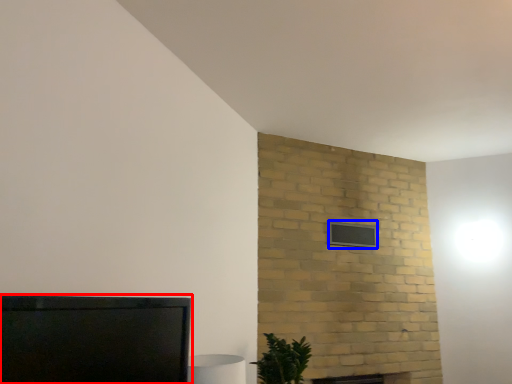
Question: Which object appears closest to the camera in this image, furniture (highlighted by a red box) or window (highlighted by a blue box)?

Choices:
 (A) furniture
 (B) window

Answer: (A)